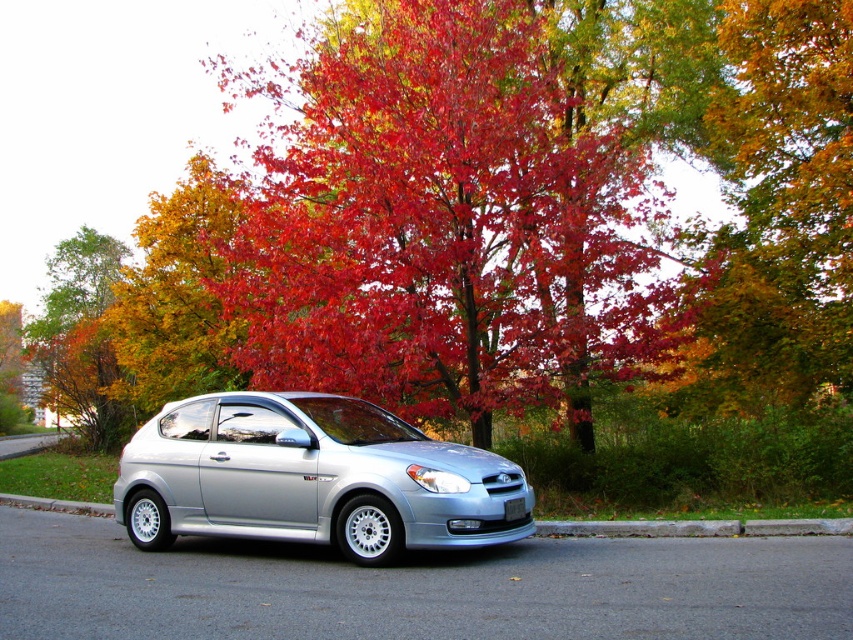
You are a photographer trying to capture the satin silver car at center and the gray concrete curb at lower center in a single frame. Based on their sizes, which object should you focus on first to ensure both are in focus?

The satin silver car at center is smaller than the gray concrete curb at lower center, so you should focus on the gray concrete curb at lower center first to ensure both are in focus.

You are a photographer trying to capture the autumn leaves at center and the white plastic license plate at center in a single shot. Which object will appear closer to the camera in the photo?

The autumn leaves at center will appear closer to the camera because they are further to the viewer than the white plastic license plate at center.

You are a pedestrian standing in front of the silver Hyundai Accent. You notice the autumn leaves at center and the white plastic license plate at center. Which object is positioned higher from the ground?

The autumn leaves at center are located above the white plastic license plate at center, so they are positioned higher from the ground.